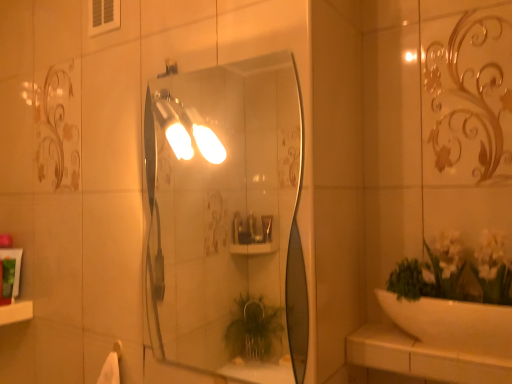
This screenshot has height=384, width=512. Find the location of `free space above white ceramic counter top at lower right (from a real-world perspective)`. free space above white ceramic counter top at lower right (from a real-world perspective) is located at coordinates (417, 339).